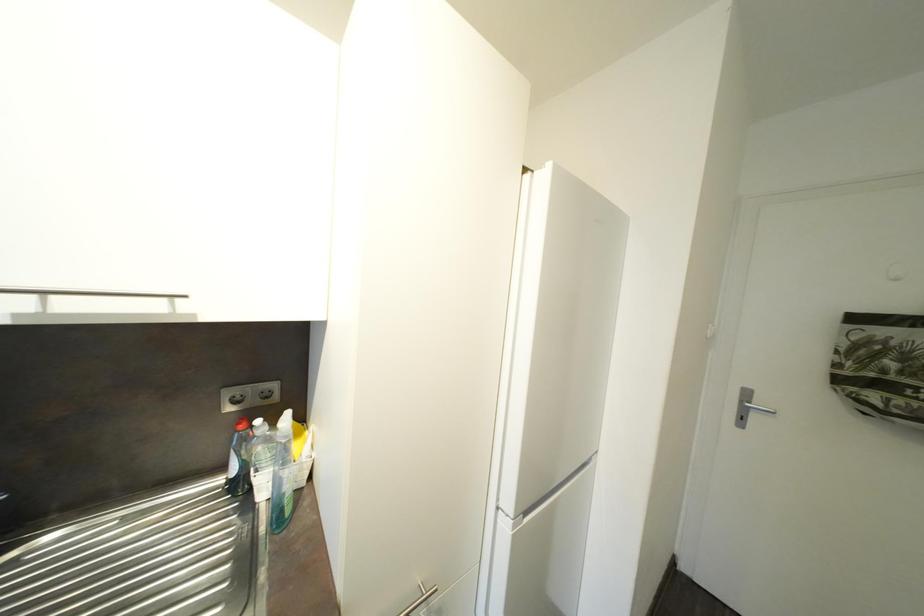
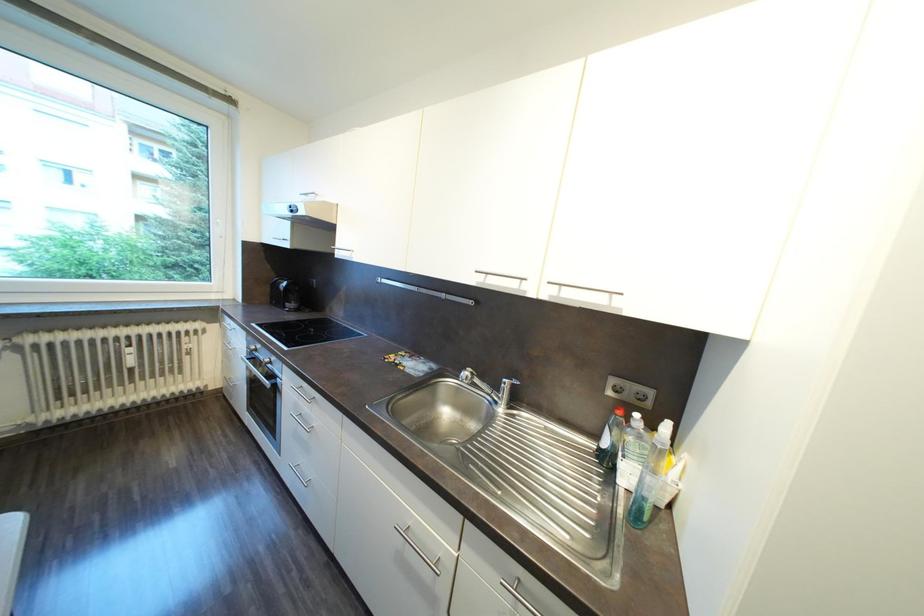
Question: Based on the continuous images, in which direction is the camera rotating? Reply with the corresponding letter.

Choices:
 (A) Left
 (B) Right
 (C) Up
 (D) Down

Answer: (A)